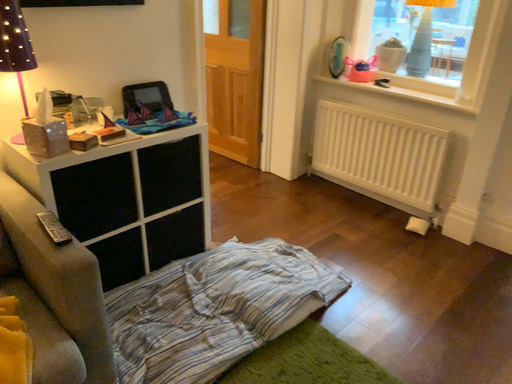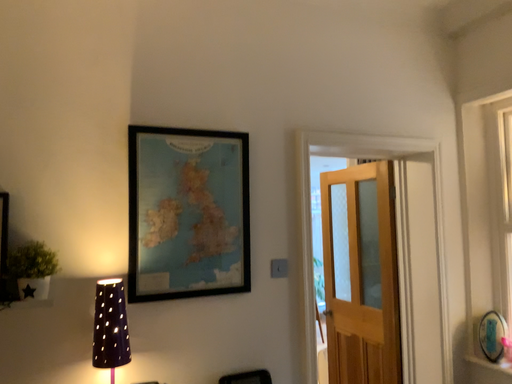
Question: Which way did the camera rotate in the video?

Choices:
 (A) rotated upward
 (B) rotated downward

Answer: (A)